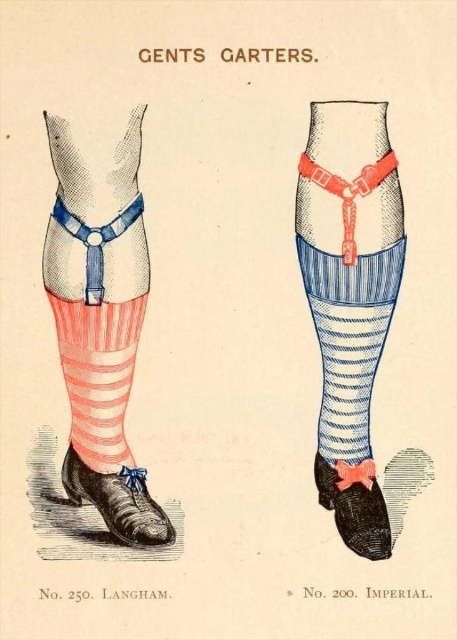
You are a tailor examining the vintage illustration of men s garters. You need to determine the spatial relationship between the striped cotton sock at lower left and the pink satin shoe at lower left. Which one occupies more space in the illustration?

The striped cotton sock at lower left has a larger size compared to the pink satin shoe at lower left, so it occupies more space in the illustration.

You are examining the vintage illustration of men garters. There are two points labeled as point (105,392) and point (111,476). Which point is nearer to you?

Point (105,392) is closer to the camera than point (111,476), so the point (105,392) is nearer to you.

You are a tailor examining the vintage illustration of men garters. You need to determine which object is bigger between the matte blue garter at left and the black suede shoe at lower right. Based on the illustration, which one is larger?

The matte blue garter at left is larger in size than the black suede shoe at lower right according to the illustration.